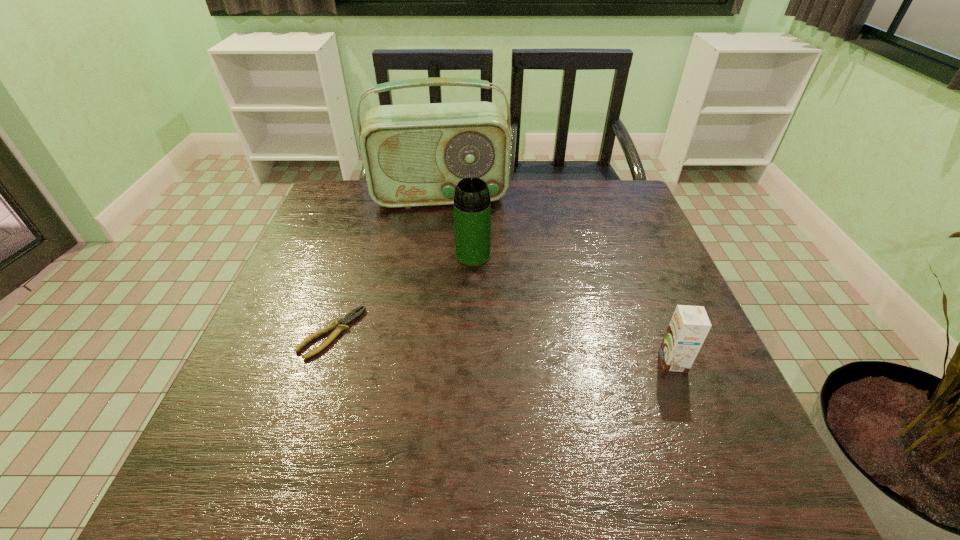
You are a GUI agent. You are given a task and a screenshot of the screen. Output one action in this format:
    pyautogui.click(x=<x>, y=<y>)
    Task: Click on the free space on the desktop that is between the pliers and the chocolate milk and is positioned from the spout of the second farthest object
    The image size is (960, 540).
    Given the screenshot: What is the action you would take?
    pyautogui.click(x=485, y=346)

This screenshot has width=960, height=540. Find the location of `free spot on the desktop that is between the pliers and the chocolate milk and is positioned on the front panel of the farthest object`. free spot on the desktop that is between the pliers and the chocolate milk and is positioned on the front panel of the farthest object is located at coordinates (450, 343).